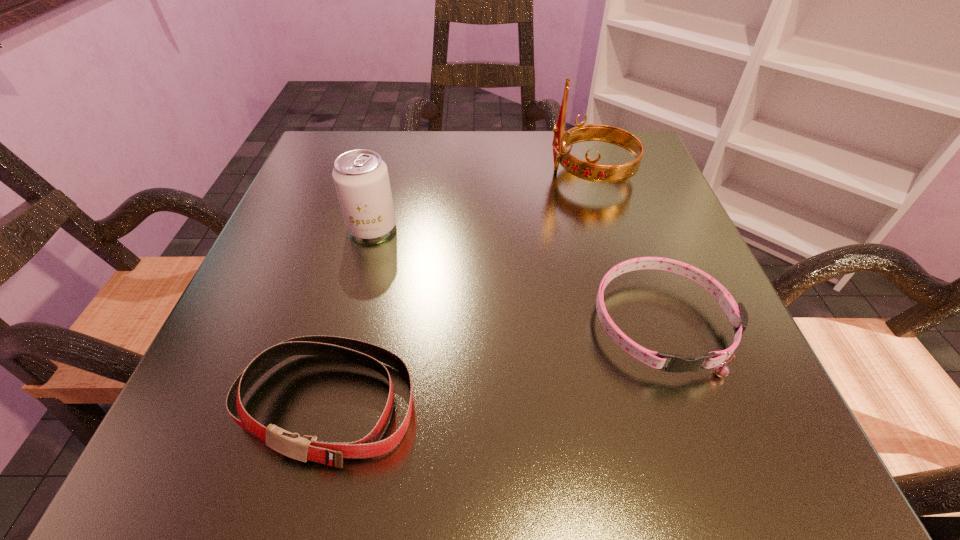
At what (x,y) coordinates should I click in order to perform the action: click on object positioned at the near left corner. Please return your answer as a coordinate pair (x, y). This screenshot has height=540, width=960. Looking at the image, I should click on (304, 448).

Locate an element on the screen. object at the far right corner is located at coordinates (590, 171).

Where is `vacant space at the far edge of the desktop`? vacant space at the far edge of the desktop is located at coordinates (464, 168).

Where is `blank space at the near edge of the desktop`? blank space at the near edge of the desktop is located at coordinates [x=338, y=431].

Where is `free space at the left edge of the desktop`? The image size is (960, 540). free space at the left edge of the desktop is located at coordinates (250, 298).

The width and height of the screenshot is (960, 540). In order to click on free space at the right edge in this screenshot , I will do `click(595, 194)`.

In the image, there is a desktop. Identify the location of vacant region at the far left corner. This screenshot has height=540, width=960. (387, 132).

Image resolution: width=960 pixels, height=540 pixels. Find the location of `vacant space at the near left corner of the desktop`. vacant space at the near left corner of the desktop is located at coordinates (160, 467).

Where is `blank area at the near right corner`? The width and height of the screenshot is (960, 540). blank area at the near right corner is located at coordinates (652, 413).

Image resolution: width=960 pixels, height=540 pixels. In order to click on empty space that is in between the shortest object and the farthest object in this screenshot , I will do `click(626, 248)`.